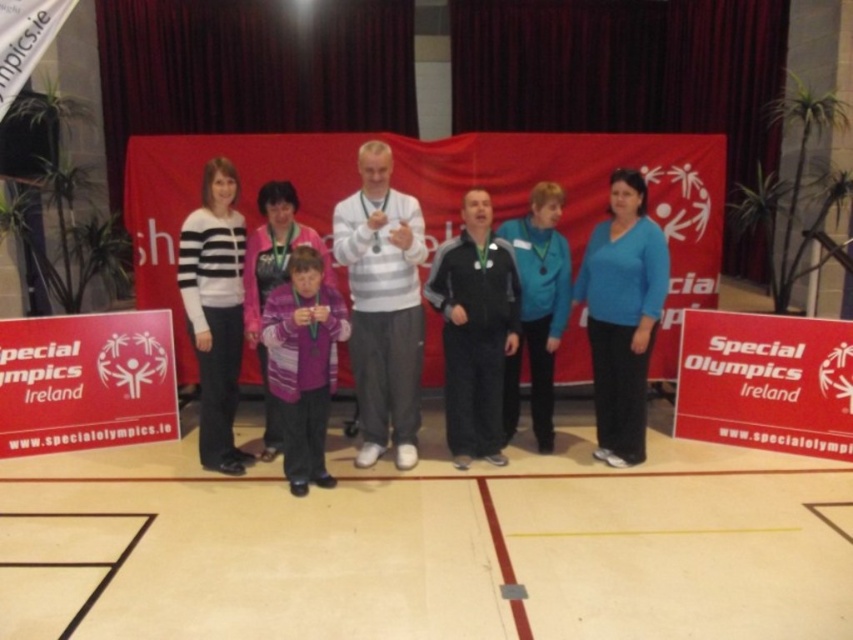
You are a photographer positioned at the back of the court. You want to take a photo of both the white striped sweater at center and the purple knitwear at center. However, you notice that one of them is blocking the other. Which person should you ask to move forward so that both are visible in the photo?

The purple knitwear at center is behind the white striped sweater at center, so you should ask the person wearing the purple knitwear at center to move forward to ensure both are visible.